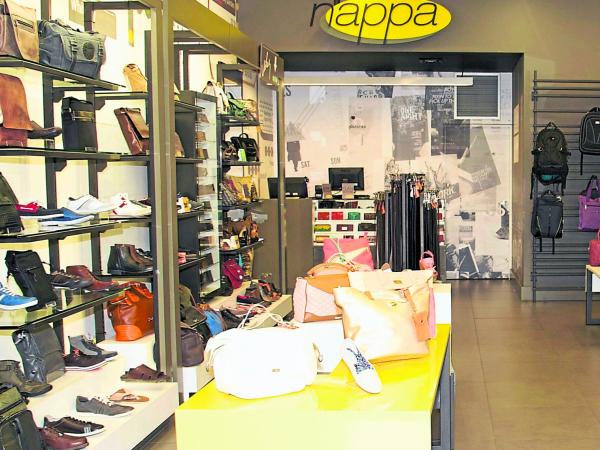
The width and height of the screenshot is (600, 450). I want to click on shelve racks, so click(554, 80), click(551, 88), click(551, 93).